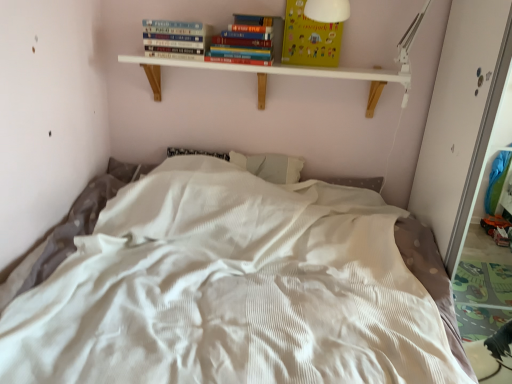
I want to click on vacant space situated above hardcover book at upper center (from a real-world perspective), so click(181, 20).